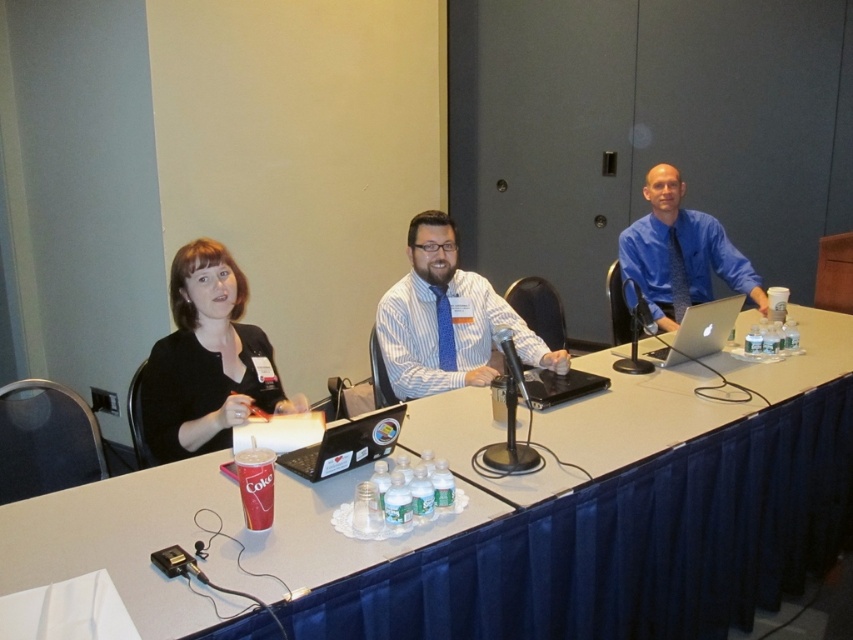
Consider the image. You are a photographer taking a photo of the panel discussion setup. You need to ensure that the matte black shirt at left and the black matte laptop at center are both visible in the frame. Based on their positions, which object should you focus on first to capture both in the shot?

The matte black shirt at left is positioned on the left side of the black matte laptop at center, so focusing on the black matte laptop at center first would allow you to include both objects in the frame since the shirt is to the left of it.